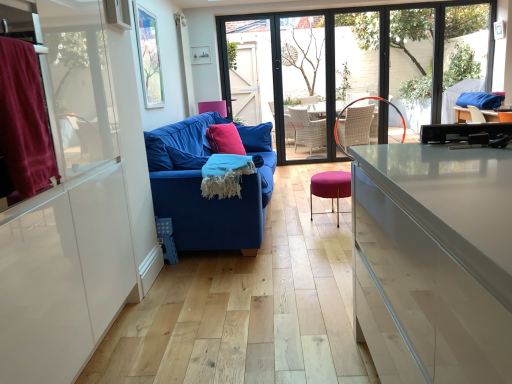
Question: Should I look upward or downward to see blue fabric couch at center?

Choices:
 (A) down
 (B) up

Answer: (B)

Question: Is pink fabric pillow at center positioned with its back to velvet burgundy curtain at left, marked as the 1th window screen in a front-to-back arrangement?

Choices:
 (A) no
 (B) yes

Answer: (A)

Question: Is pink fabric pillow at center taller than velvet burgundy curtain at left, marked as the 1th window screen in a front-to-back arrangement?

Choices:
 (A) yes
 (B) no

Answer: (B)

Question: Is pink fabric pillow at center shorter than velvet burgundy curtain at left, marked as the second window screen in a back-to-front arrangement?

Choices:
 (A) no
 (B) yes

Answer: (B)

Question: Is pink fabric pillow at center next to velvet burgundy curtain at left, which is counted as the first window screen, starting from the bottom?

Choices:
 (A) no
 (B) yes

Answer: (A)

Question: From a real-world perspective, is pink fabric pillow at center located beneath velvet burgundy curtain at left, marked as the second window screen in a back-to-front arrangement?

Choices:
 (A) no
 (B) yes

Answer: (B)

Question: From the image's perspective, is pink fabric pillow at center located beneath velvet burgundy curtain at left, marked as the second window screen in a back-to-front arrangement?

Choices:
 (A) yes
 (B) no

Answer: (B)

Question: Considering the relative positions of blue woven blanket at center and transparent glass screen door at center in the image provided, is blue woven blanket at center to the left of transparent glass screen door at center from the viewer's perspective?

Choices:
 (A) no
 (B) yes

Answer: (B)

Question: From the image's perspective, does blue woven blanket at center appear lower than transparent glass screen door at center?

Choices:
 (A) no
 (B) yes

Answer: (B)

Question: Can you confirm if blue woven blanket at center is positioned to the right of transparent glass screen door at center?

Choices:
 (A) no
 (B) yes

Answer: (A)

Question: Is blue woven blanket at center facing away from transparent glass screen door at center?

Choices:
 (A) yes
 (B) no

Answer: (B)

Question: From a real-world perspective, is blue woven blanket at center physically below transparent glass screen door at center?

Choices:
 (A) yes
 (B) no

Answer: (A)

Question: Is blue woven blanket at center wider than transparent glass screen door at center?

Choices:
 (A) yes
 (B) no

Answer: (A)

Question: Is transparent glass window at center next to blue fabric couch at center and touching it?

Choices:
 (A) no
 (B) yes

Answer: (A)